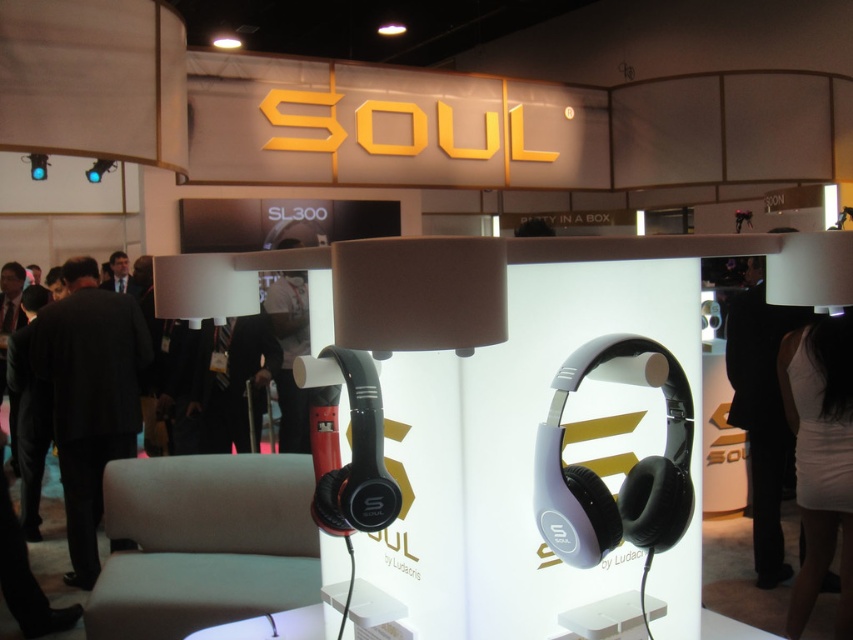
Question: Among these objects, which one is farthest from the camera?

Choices:
 (A) light gray fabric stool at lower left
 (B) matte purple plastic headphones at center
 (C) white fabric bag at center
 (D) black suit at left

Answer: (C)

Question: Among these points, which one is farthest from the camera?

Choices:
 (A) (589, 484)
 (B) (809, 560)

Answer: (B)

Question: Which object appears closest to the camera in this image?

Choices:
 (A) black suit at left
 (B) light gray fabric stool at lower left

Answer: (B)

Question: Is white matte dress at lower right further to camera compared to black suit at right?

Choices:
 (A) yes
 (B) no

Answer: (B)

Question: Is matte purple plastic headphones at center to the right of white matte dress at lower right from the viewer's perspective?

Choices:
 (A) no
 (B) yes

Answer: (A)

Question: Is matte purple plastic headphones at center below white fabric bag at center?

Choices:
 (A) no
 (B) yes

Answer: (B)